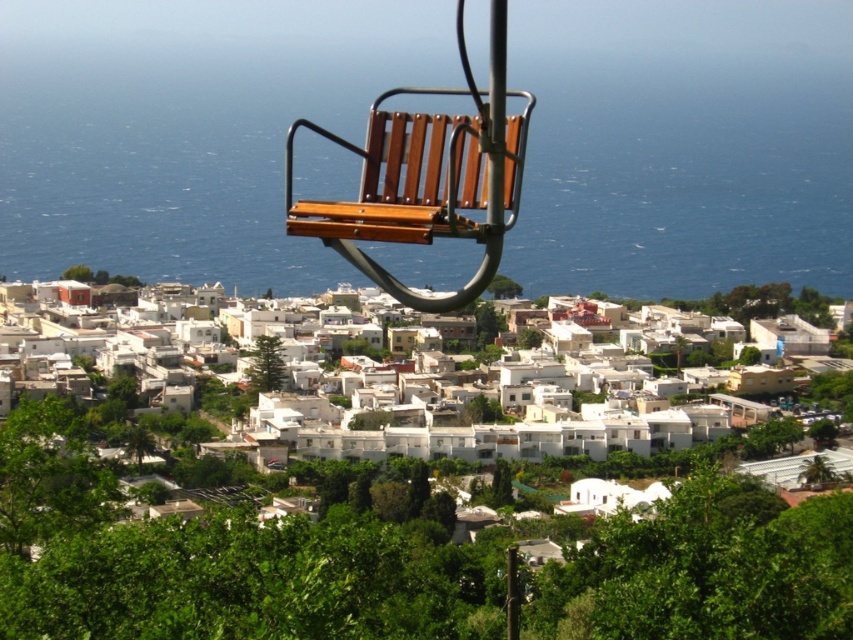
Can you confirm if blue water at center is wider than wooden bench at center?

Yes, blue water at center is wider than wooden bench at center.

Between blue water at center and wooden bench at center, which one appears on the right side from the viewer's perspective?

Positioned to the right is blue water at center.

Measure the distance between point (x=270, y=188) and camera.

They are 660.56 meters apart.

Find the location of a particular element. The width and height of the screenshot is (853, 640). blue water at center is located at coordinates (173, 157).

Can you confirm if blue water at center is positioned to the right of white matte buildings at center?

Indeed, blue water at center is positioned on the right side of white matte buildings at center.

Does blue water at center have a lesser width compared to white matte buildings at center?

Incorrect, blue water at center's width is not less than white matte buildings at center's.

What do you see at coordinates (173, 157) in the screenshot? This screenshot has width=853, height=640. I see `blue water at center` at bounding box center [173, 157].

Locate an element on the screen. blue water at center is located at coordinates point(173,157).

Does white matte buildings at center appear on the left side of wooden bench at center?

In fact, white matte buildings at center is to the right of wooden bench at center.

Where is `white matte buildings at center`? white matte buildings at center is located at coordinates (485, 426).

Locate an element on the screen. This screenshot has height=640, width=853. white matte buildings at center is located at coordinates (485, 426).